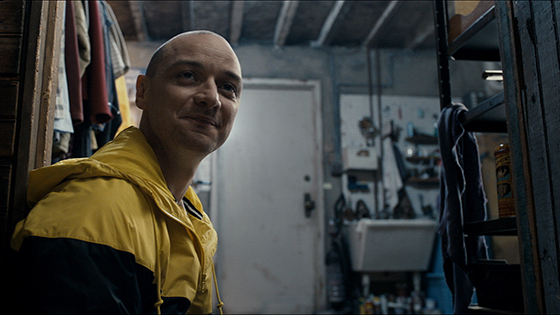
The height and width of the screenshot is (315, 560). What are the coordinates of `ceiling` in the screenshot? It's located at [265, 20].